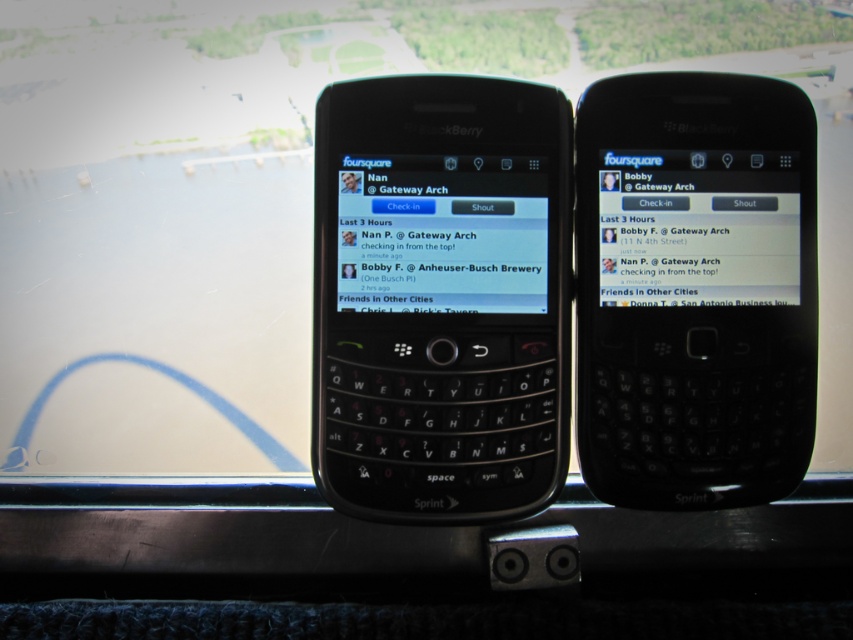
Question: Which object appears farthest from the camera in this image?

Choices:
 (A) matte black phone at center
 (B) matte black screen at center

Answer: (A)

Question: Which of these objects is positioned closest to the black plastic smartphone at right?

Choices:
 (A) black glossy screen at upper center
 (B) black matte keyboard at center
 (C) matte black phone at center

Answer: (A)

Question: Which point is farther from the camera taking this photo?

Choices:
 (A) (747, 435)
 (B) (346, 173)
 (C) (486, 468)

Answer: (B)

Question: In this image, where is matte black screen at center located relative to matte black phone at center?

Choices:
 (A) above
 (B) below

Answer: (B)

Question: Does matte black screen at center have a smaller size compared to matte black phone at center?

Choices:
 (A) yes
 (B) no

Answer: (B)

Question: Can you confirm if matte black screen at center is positioned below black glossy screen at upper center?

Choices:
 (A) no
 (B) yes

Answer: (B)